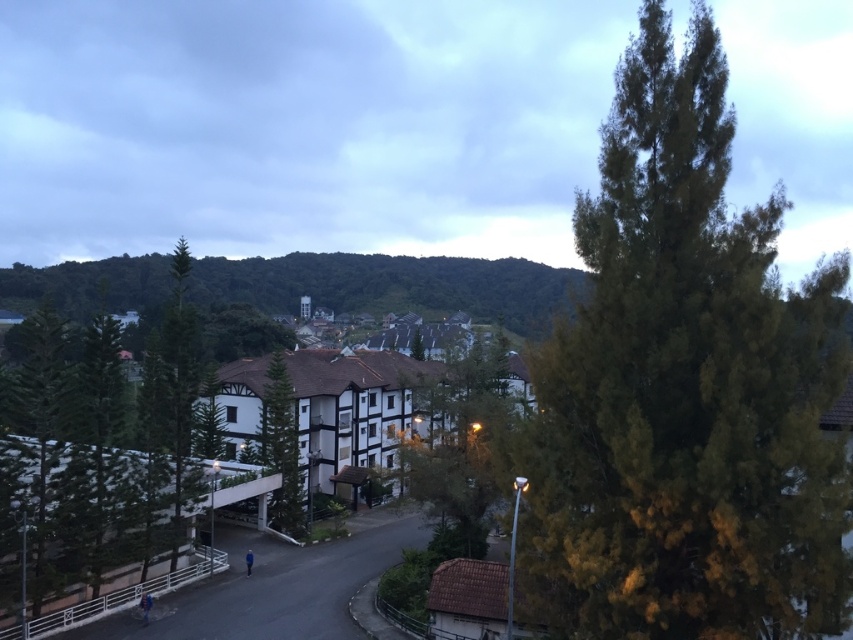
Question: Does green leafy tree at right appear on the right side of green leafy tree at center?

Choices:
 (A) no
 (B) yes

Answer: (B)

Question: Which of the following is the closest to the observer?

Choices:
 (A) green leafy hill at center
 (B) green leafy tree at center

Answer: (A)

Question: Does green leafy hill at center have a larger size compared to green leafy tree at center?

Choices:
 (A) no
 (B) yes

Answer: (B)

Question: Which is nearer to the green leafy hill at center?

Choices:
 (A) green leafy tree at upper right
 (B) green leafy tree at center
 (C) green textured tree at center
 (D) green leafy tree at right

Answer: (C)

Question: Is green leafy tree at right closer to the viewer compared to green leafy tree at center?

Choices:
 (A) yes
 (B) no

Answer: (A)

Question: Which object is the farthest from the green leafy tree at right?

Choices:
 (A) green leafy hill at center
 (B) green leafy tree at upper right
 (C) green leafy tree at center
 (D) green textured tree at center

Answer: (B)